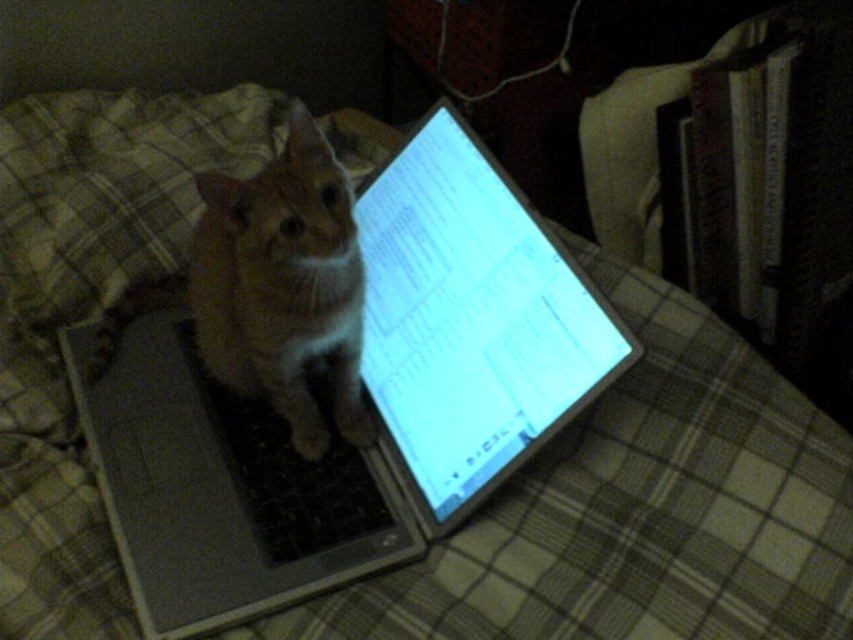
Can you confirm if silver metallic laptop at center is thinner than black matte keyboard at center?

No, silver metallic laptop at center is not thinner than black matte keyboard at center.

What do you see at coordinates (358, 384) in the screenshot?
I see `silver metallic laptop at center` at bounding box center [358, 384].

Is point (341, 541) closer to viewer compared to point (328, 477)?

Yes, point (341, 541) is closer to viewer.

Image resolution: width=853 pixels, height=640 pixels. In order to click on silver metallic laptop at center in this screenshot , I will do `click(358, 384)`.

Locate an element on the screen. silver metallic laptop at center is located at coordinates (358, 384).

Who is lower down, silver metallic laptop at center or orange fur tabby cat at center?

silver metallic laptop at center

Which is in front, point (567, 301) or point (230, 376)?

Point (567, 301) is in front.

Identify the location of silver metallic laptop at center. This screenshot has height=640, width=853. (358, 384).

Can you confirm if orange fur tabby cat at center is wider than black matte keyboard at center?

Yes.

Is orange fur tabby cat at center shorter than black matte keyboard at center?

In fact, orange fur tabby cat at center may be taller than black matte keyboard at center.

Who is more distant from viewer, (318, 456) or (250, 486)?

The point (318, 456) is more distant.

The image size is (853, 640). I want to click on orange fur tabby cat at center, so click(x=271, y=288).